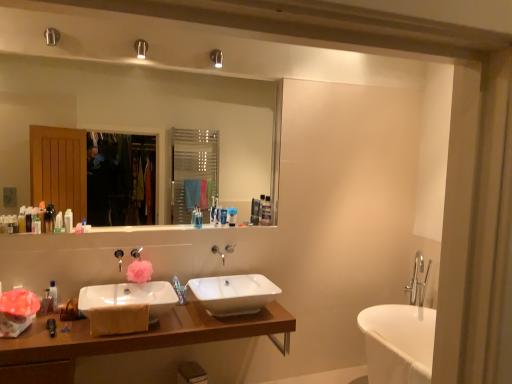
Where is `free spot above white glossy mirror at upper center (from a real-world perspective)`? This screenshot has height=384, width=512. free spot above white glossy mirror at upper center (from a real-world perspective) is located at coordinates (109, 66).